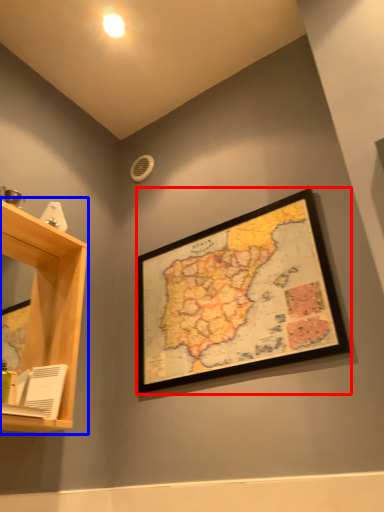
Question: Which point is further to the camera, picture frame (highlighted by a red box) or shelf (highlighted by a blue box)?

Choices:
 (A) picture frame
 (B) shelf

Answer: (A)